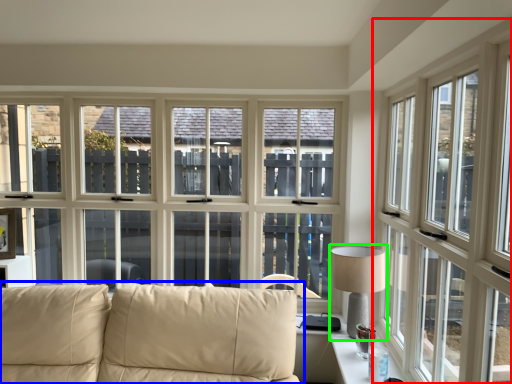
Question: Estimate the real-world distances between objects in this image. Which object is closer to window (highlighted by a red box), studio couch (highlighted by a blue box) or table lamp (highlighted by a green box)?

Choices:
 (A) studio couch
 (B) table lamp

Answer: (B)